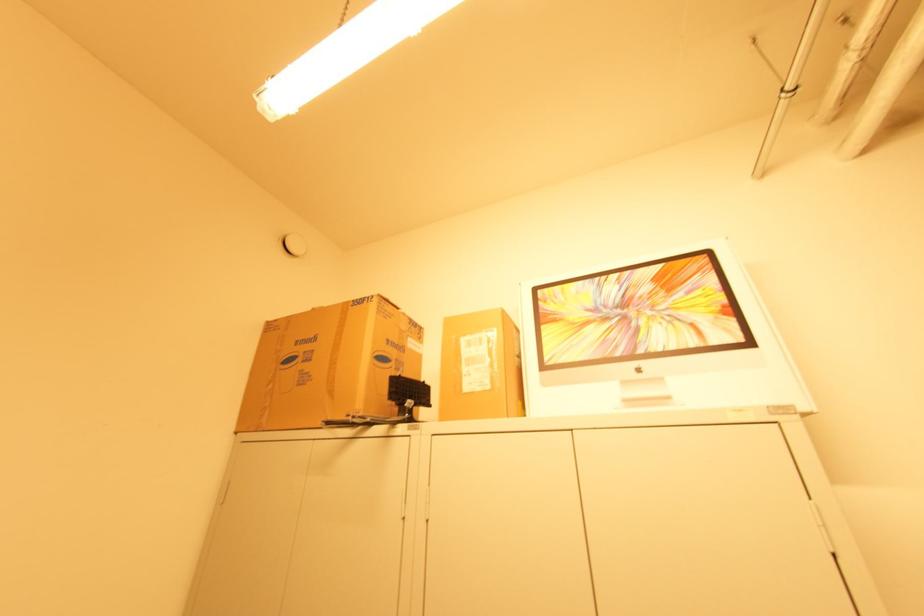
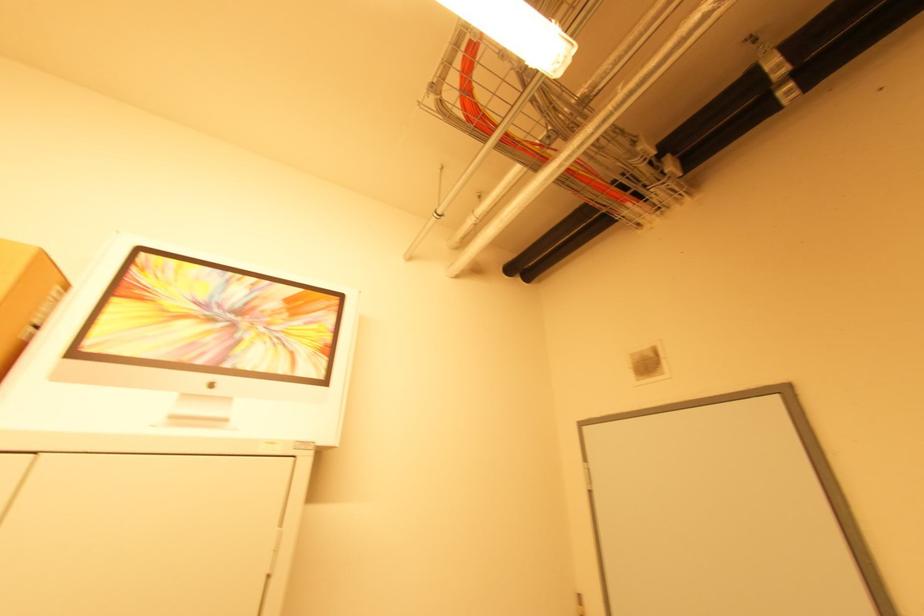
Question: How did the camera likely rotate?

Choices:
 (A) Left
 (B) Right
 (C) Up
 (D) Down

Answer: (B)